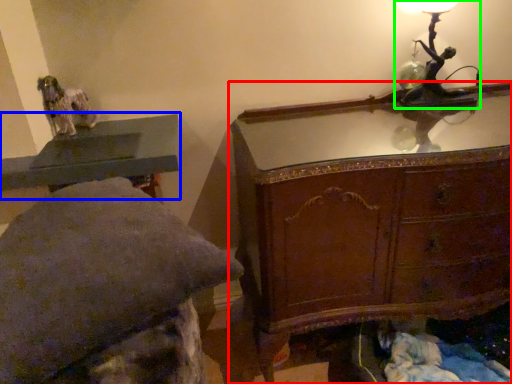
Question: Which object is positioned farthest from chest of drawers (highlighted by a red box)? Select from table (highlighted by a blue box) and table lamp (highlighted by a green box).

Choices:
 (A) table
 (B) table lamp

Answer: (A)